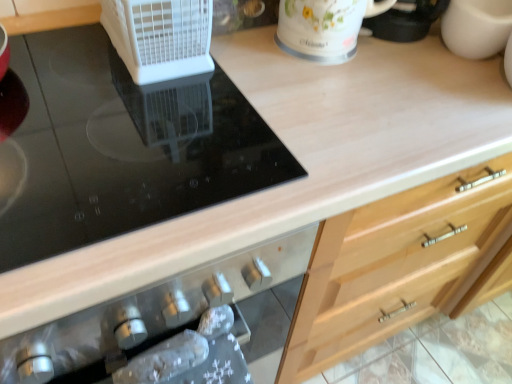
Measure the distance between white plastic fan at upper left and camera.

white plastic fan at upper left is 24.56 inches away from camera.

Identify the location of white floral mug at upper center. The width and height of the screenshot is (512, 384). (324, 27).

The width and height of the screenshot is (512, 384). In order to click on black glass cooktop at upper left in this screenshot , I will do `click(121, 147)`.

Considering the sizes of objects white floral mug at upper center and white plastic fan at upper left in the image provided, who is smaller, white floral mug at upper center or white plastic fan at upper left?

white plastic fan at upper left.

Which object is further away from the camera taking this photo, white floral mug at upper center or white plastic fan at upper left?

white floral mug at upper center is further away from the camera.

Find the location of a particular element. mug above the white plastic fan at upper left (from a real-world perspective) is located at coordinates (324, 27).

Can white floral mug at upper center be found inside black glass cooktop at upper left?

No.

From the image's perspective, which object appears higher, black glass cooktop at upper left or white floral mug at upper center?

From the image's view, white floral mug at upper center is above.

In the image, is black glass cooktop at upper left positioned in front of or behind white floral mug at upper center?

In the image, black glass cooktop at upper left appears in front of white floral mug at upper center.

Looking at the image, does black glass cooktop at upper left seem bigger or smaller compared to white floral mug at upper center?

In the image, black glass cooktop at upper left appears to be larger than white floral mug at upper center.

The width and height of the screenshot is (512, 384). Identify the location of gas stove on the left of white floral mug at upper center. (121, 147).

Considering the sizes of objects white floral mug at upper center and black glass cooktop at upper left in the image provided, who is wider, white floral mug at upper center or black glass cooktop at upper left?

black glass cooktop at upper left.

Is white floral mug at upper center located outside black glass cooktop at upper left?

That's correct, white floral mug at upper center is outside of black glass cooktop at upper left.

From a real-world perspective, which is physically above, white floral mug at upper center or black glass cooktop at upper left?

white floral mug at upper center, from a real-world perspective.

From the image's perspective, which is below, white plastic fan at upper left or white floral mug at upper center?

white plastic fan at upper left, from the image's perspective.

From a real-world perspective, who is located lower, white plastic fan at upper left or white floral mug at upper center?

In real-world perspective, white plastic fan at upper left is lower.

Considering the positions of objects white plastic fan at upper left and white floral mug at upper center in the image provided, who is in front, white plastic fan at upper left or white floral mug at upper center?

white plastic fan at upper left is in front.

Between white plastic fan at upper left and white floral mug at upper center, which one has less height?

With less height is white plastic fan at upper left.

How much distance is there between black glass cooktop at upper left and white plastic fan at upper left?

black glass cooktop at upper left is 5.57 inches from white plastic fan at upper left.

From a real-world perspective, which is physically above, black glass cooktop at upper left or white plastic fan at upper left?

white plastic fan at upper left is physically above.

Is black glass cooktop at upper left not near white plastic fan at upper left?

Actually, black glass cooktop at upper left and white plastic fan at upper left are a little close together.

Considering the positions of point (220, 140) and point (162, 6), is point (220, 140) closer or farther from the camera than point (162, 6)?

Point (220, 140) is closer to the camera than point (162, 6).

What's the angular difference between white plastic fan at upper left and black glass cooktop at upper left's facing directions?

The angle between the facing direction of white plastic fan at upper left and the facing direction of black glass cooktop at upper left is 0.254 degrees.

From the image's perspective, would you say white plastic fan at upper left is shown under black glass cooktop at upper left?

No.

Between white plastic fan at upper left and black glass cooktop at upper left, which one has less height?

With less height is black glass cooktop at upper left.

Is white plastic fan at upper left bigger than black glass cooktop at upper left?

Actually, white plastic fan at upper left might be smaller than black glass cooktop at upper left.

Identify the location of mug above the white plastic fan at upper left (from the image's perspective). (324, 27).

Locate an element on the screen. The image size is (512, 384). gas stove on the left of white floral mug at upper center is located at coordinates (121, 147).

Estimate the real-world distances between objects in this image. Which object is closer to white floral mug at upper center, black glass cooktop at upper left or white plastic fan at upper left?

The object closer to white floral mug at upper center is white plastic fan at upper left.

Looking at this image, looking at the image, which one is located closer to white plastic fan at upper left, white floral mug at upper center or black glass cooktop at upper left?

The object closer to white plastic fan at upper left is black glass cooktop at upper left.

Considering their positions, is white plastic fan at upper left positioned closer to black glass cooktop at upper left than white floral mug at upper center?

white plastic fan at upper left.

Which object lies further to the anchor point white floral mug at upper center, white plastic fan at upper left or black glass cooktop at upper left?

Based on the image, black glass cooktop at upper left appears to be further to white floral mug at upper center.

When comparing their distances from black glass cooktop at upper left, does white floral mug at upper center or white plastic fan at upper left seem further?

Based on the image, white floral mug at upper center appears to be further to black glass cooktop at upper left.

Estimate the real-world distances between objects in this image. Which object is closer to white plastic fan at upper left, black glass cooktop at upper left or white floral mug at upper center?

The object closer to white plastic fan at upper left is black glass cooktop at upper left.

Locate an element on the screen. kitchen appliance located between black glass cooktop at upper left and white floral mug at upper center in the left-right direction is located at coordinates 160,37.